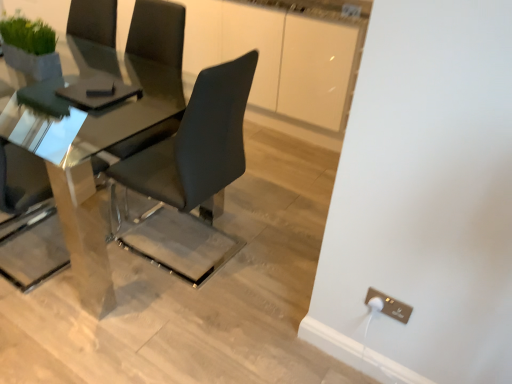
Question: Is point (231, 84) closer or farther from the camera than point (394, 309)?

Choices:
 (A) farther
 (B) closer

Answer: (A)

Question: Relative to metallic gold electrical outlet at lower right, is matte black chair at center in front or behind?

Choices:
 (A) behind
 (B) front

Answer: (B)

Question: Which is nearer to the metallic gold electrical outlet at lower right?

Choices:
 (A) matte black chair at center
 (B) polished glass table at center

Answer: (A)

Question: Which is nearer to the metallic gold electrical outlet at lower right?

Choices:
 (A) matte black chair at center
 (B) polished glass table at center

Answer: (A)